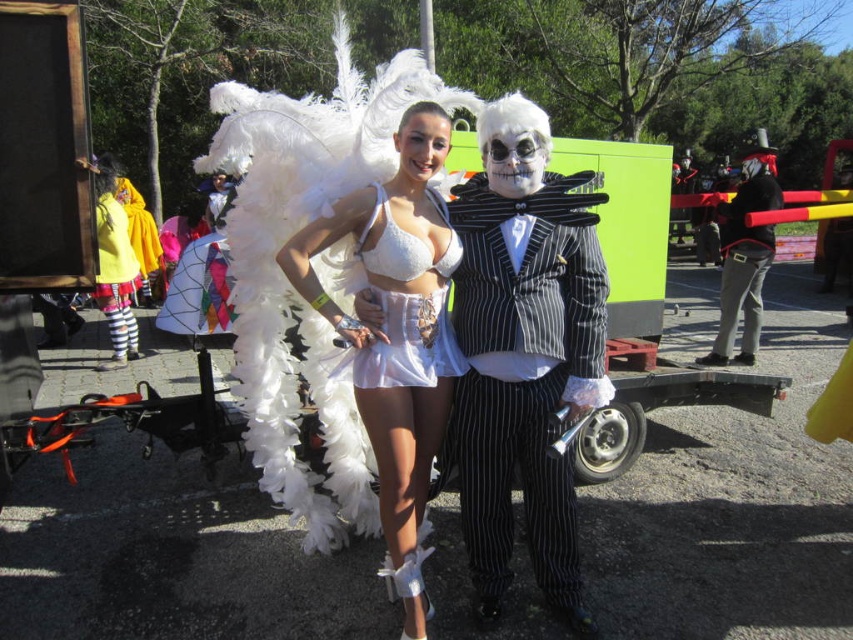
Question: Does white satin dress at center have a larger size compared to yellow fabric coat at left?

Choices:
 (A) yes
 (B) no

Answer: (B)

Question: Considering the real-world distances, which object is closest to the yellow fabric coat at left?

Choices:
 (A) white feathered wings at center
 (B) matte black suit at center

Answer: (A)

Question: Considering the real-world distances, which object is closest to the matte black suit at center?

Choices:
 (A) white satin dress at center
 (B) matte black suit at right

Answer: (A)

Question: Is white satin dress at center further to camera compared to yellow fabric coat at left?

Choices:
 (A) yes
 (B) no

Answer: (B)

Question: Which point is closer to the camera?

Choices:
 (A) matte black suit at right
 (B) yellow fabric coat at left
 (C) matte black suit at center
 (D) white feathered wings at center

Answer: (D)

Question: Where is matte black suit at center located in relation to yellow fabric coat at left in the image?

Choices:
 (A) above
 (B) below

Answer: (B)